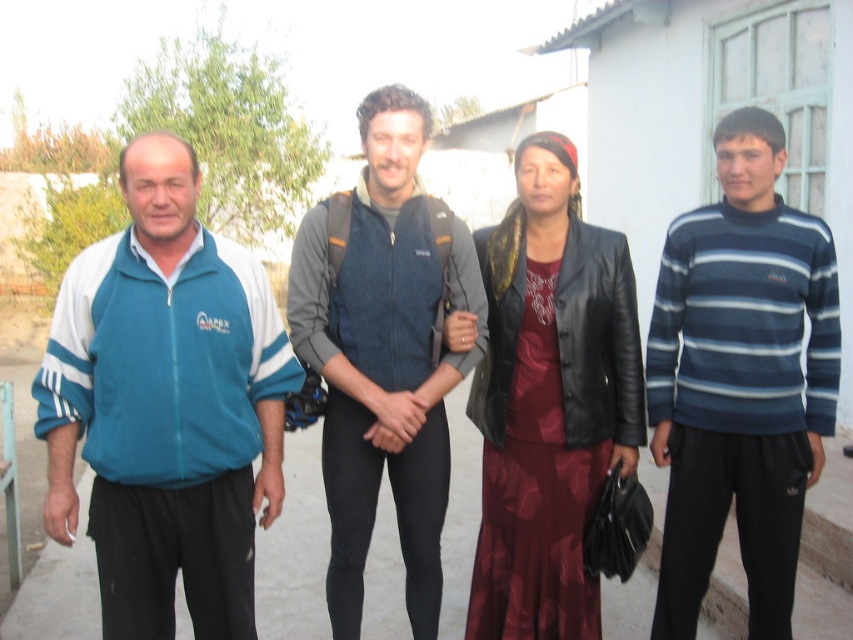
Is teal fabric jacket at left to the right of denim jacket at center from the viewer's perspective?

No, teal fabric jacket at left is not to the right of denim jacket at center.

Does teal fabric jacket at left have a greater width compared to denim jacket at center?

Yes.

The width and height of the screenshot is (853, 640). What do you see at coordinates (166, 404) in the screenshot? I see `teal fabric jacket at left` at bounding box center [166, 404].

Locate an element on the screen. The height and width of the screenshot is (640, 853). teal fabric jacket at left is located at coordinates (166, 404).

Can you confirm if blue striped sweater at right is wider than leather jacket at center?

No, blue striped sweater at right is not wider than leather jacket at center.

Between blue striped sweater at right and leather jacket at center, which one has more height?

blue striped sweater at right

Which is behind, point (718, 538) or point (556, 508)?

The point (718, 538) is more distant.

Identify the location of blue striped sweater at right. (740, 380).

Who is positioned more to the left, blue striped sweater at right or denim jacket at center?

denim jacket at center is more to the left.

Who is more forward, (x=790, y=502) or (x=323, y=461)?

Point (x=790, y=502)

Which is in front, point (776, 275) or point (418, 257)?

Point (776, 275) is more forward.

Where is `blue striped sweater at right`? The height and width of the screenshot is (640, 853). blue striped sweater at right is located at coordinates tap(740, 380).